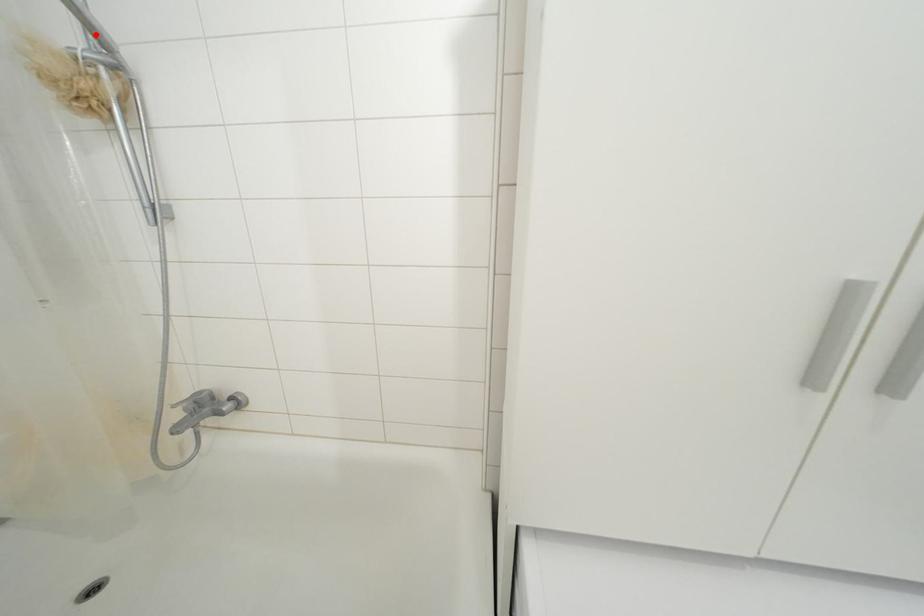
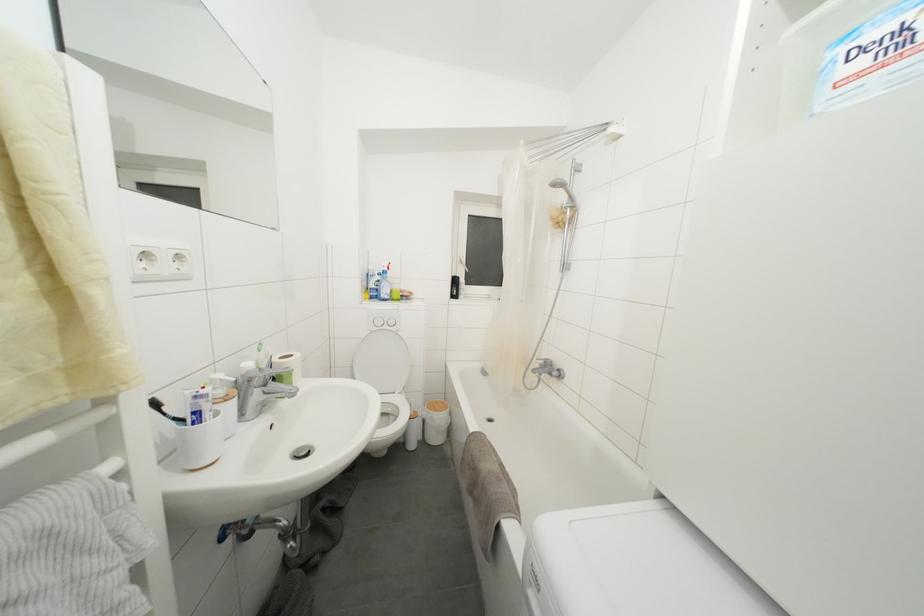
Question: I am providing you with two images of the same scene from different viewpoints. Image1 has a red point marked. In image2, the corresponding 3D location appears at what relative position? Reply with the corresponding letter.

Choices:
 (A) Closer
 (B) Farther

Answer: (A)